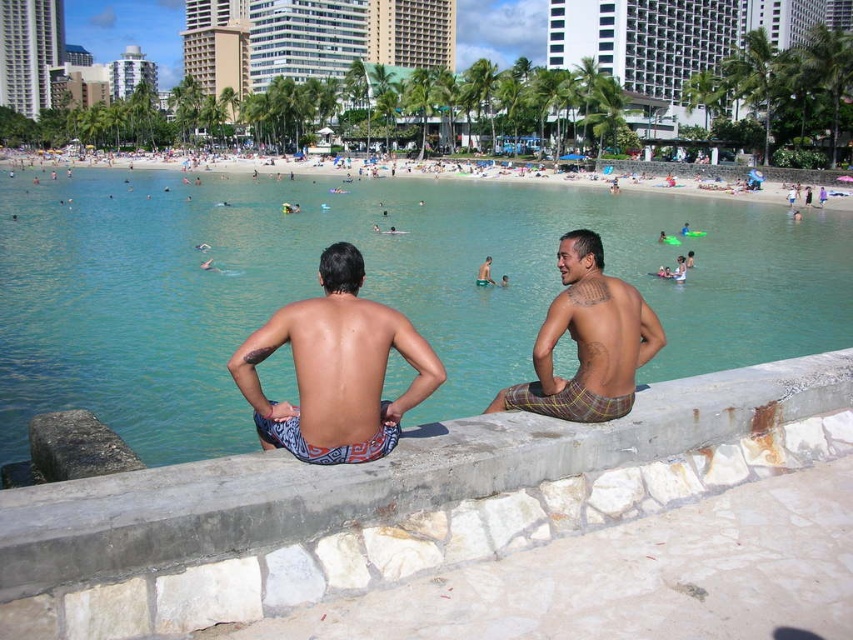
You are standing at the point labeled as point (379, 476) in the image. What surface are you standing on?

You are standing on the concrete at center.

You are standing at the position of the viewer. You want to throw a ball to the blue patterned shorts at center. Is the distance within your throwing range of 25 meters?

The blue patterned shorts at center and viewer are 25.15 meters apart from each other, so the distance is slightly beyond your throwing range of 25 meters.

You are a person standing on the beach and want to place a small potted plant between the concrete at center and the smooth tan skin at center. Which object should the plant be placed closer to if you want it to be more elevated?

The concrete at center has a greater height compared to smooth tan skin at center, so the plant should be placed closer to the concrete at center to be more elevated.